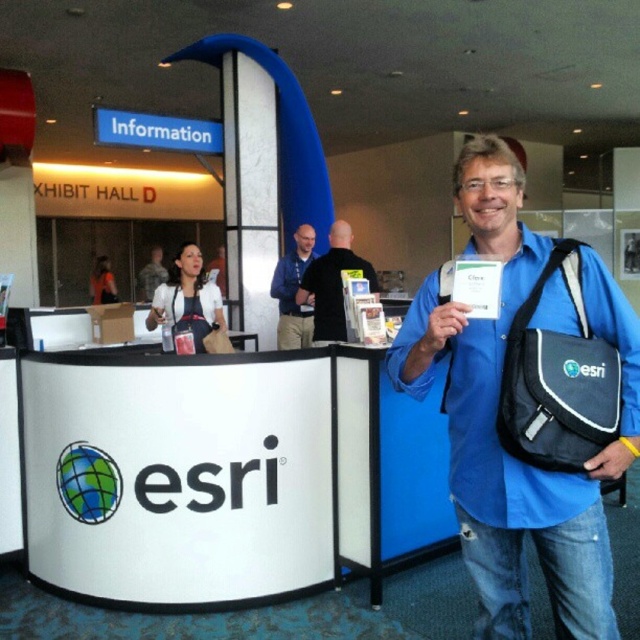
You are at an event and need to hand out a flyer to both the person in the blue shirt at center and the camouflage uniform at center. Given that you can only walk 5 meters from your current position, can you reach both individuals?

The blue shirt at center and camouflage uniform at center are 7.38 meters apart. Since you can only walk 5 meters from your current position, you cannot reach both individuals as the distance between them exceeds your walking range.

You are a photographer at the convention. You want to take a photo that includes both the blue shirt at center and the camouflage uniform at center. Which one should you focus on to ensure both are in frame?

Since the blue shirt at center is smaller in size compared to the camouflage uniform at center, you should focus on the camouflage uniform at center to ensure both are in frame.

Looking at the image of the convention hall, you see a man wearing a blue fabric shirt at center and a black matte shirt at center. Which one is positioned to the right?

The blue fabric shirt at center is positioned to the right of the black matte shirt at center.